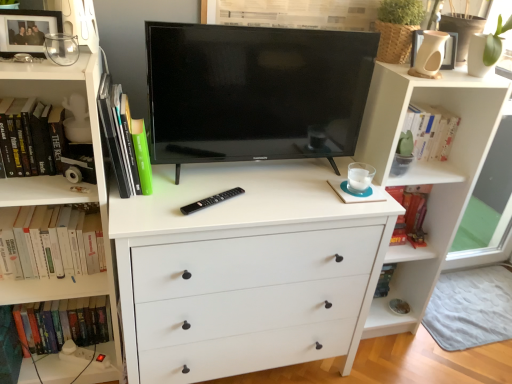
In order to click on empty space that is ontop of white matte chest of drawers at center (from a real-world perspective) in this screenshot , I will do `click(233, 191)`.